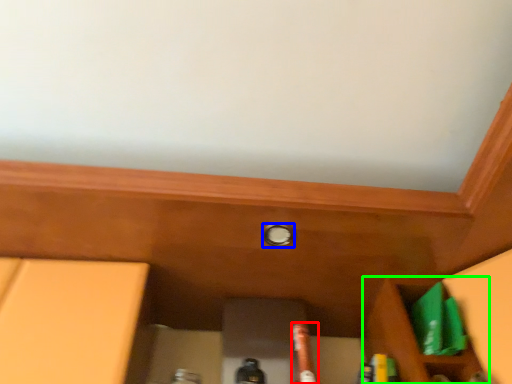
Question: Based on their relative distances, which object is farther from beer bottle (highlighted by a red box)? Choose from knob (highlighted by a blue box) and cabinetry (highlighted by a green box).

Choices:
 (A) knob
 (B) cabinetry

Answer: (A)